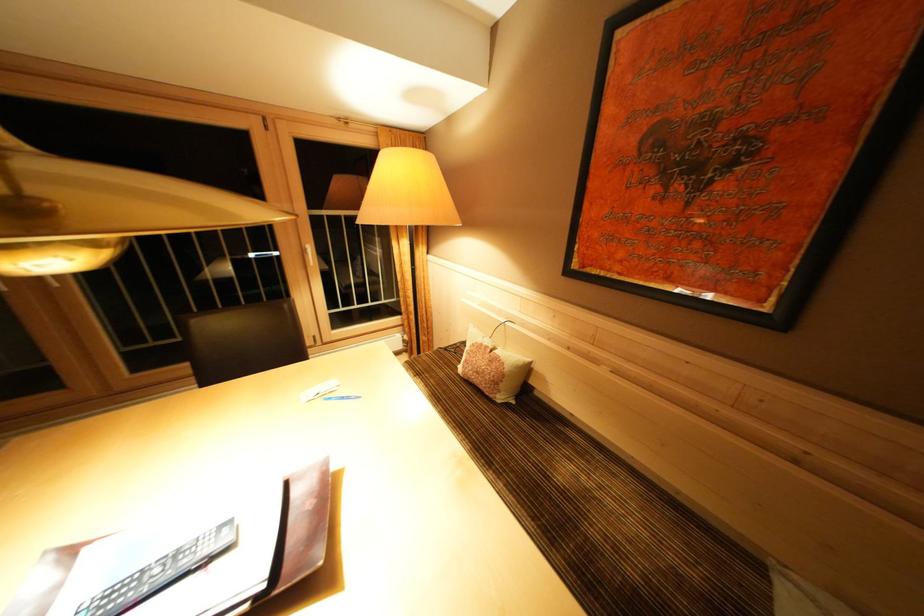
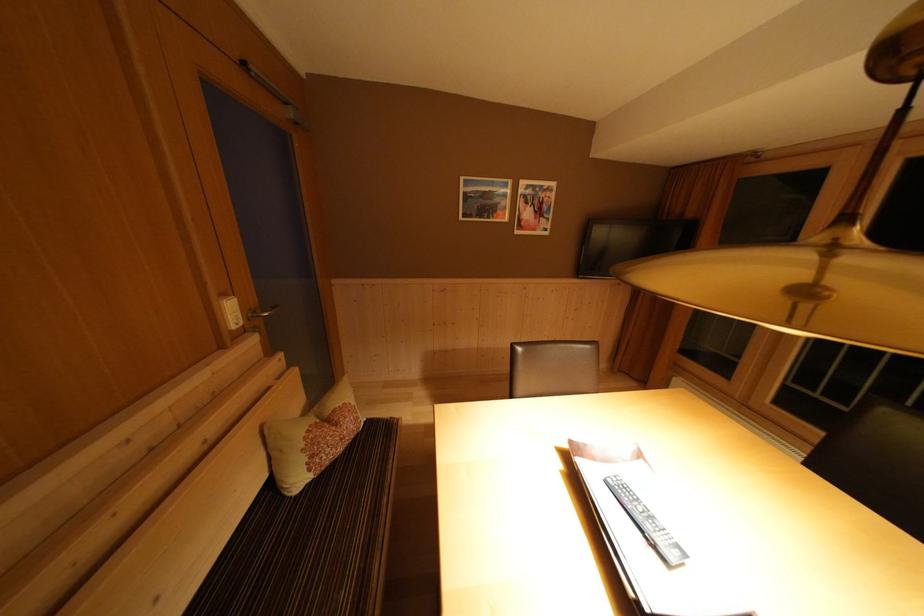
How did the camera likely rotate?

The camera's rotation is toward left-down.